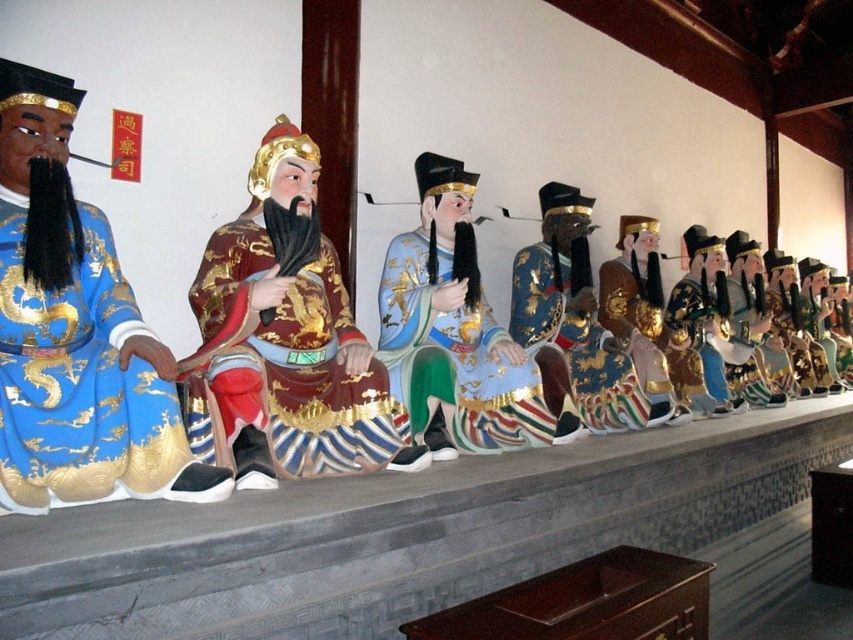
You are an interior designer planning to place a 1.2 meter wide decorative panel between the blue silk robe at left and the shiny gold brocade robe at center. Given their widths, will the panel fit without overlapping either robe?

The blue silk robe at left is narrower than the shiny gold brocade robe at center. The total space between them would depend on their combined widths and spacing, but since the panel is 1.2 meters wide, it might fit if the distance between the robes is sufficient. However, without exact measurements of the gap, we cannot confirm overlap. The question only states the blue robe is narrower, not the distance between them.

You are an art curator examining the statues in the traditional Chinese building. You notice two statues with similar blue robes at the center. Which statue has the shiny blue silk robe at center located to the left of the shiny blue fabric robe at center?

The shiny blue silk robe at center is located to the left of the shiny blue fabric robe at center.